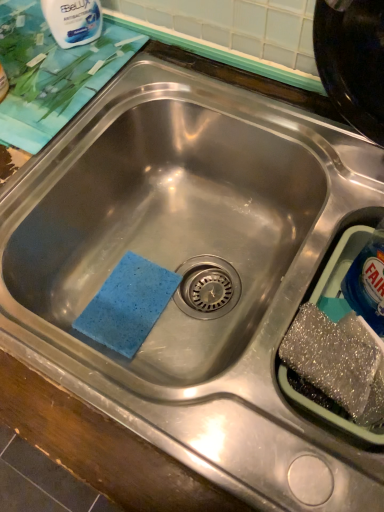
Find the location of `vacant area that is in front of white glossy bottle at upper left`. vacant area that is in front of white glossy bottle at upper left is located at coordinates (61, 86).